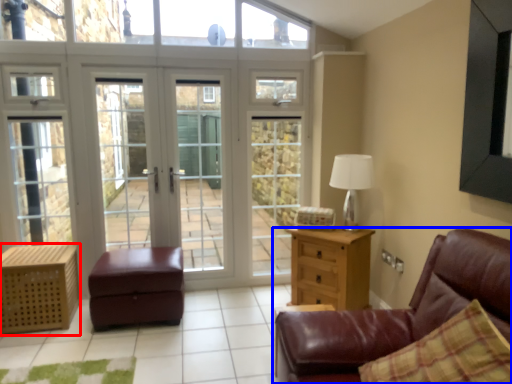
Question: Which of the following is the farthest to the observer, nightstand (highlighted by a red box) or studio couch (highlighted by a blue box)?

Choices:
 (A) nightstand
 (B) studio couch

Answer: (A)